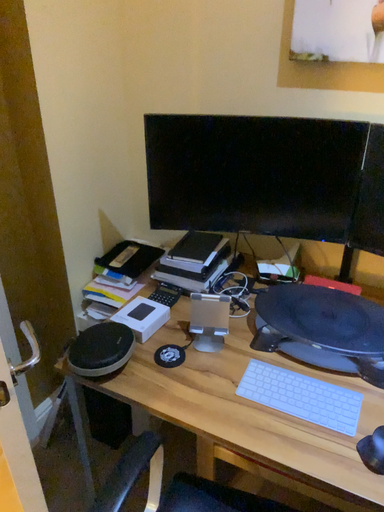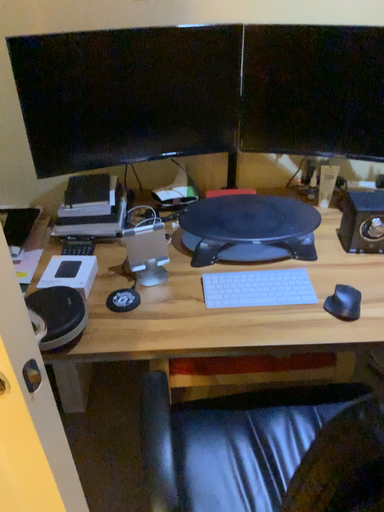
Question: How did the camera likely rotate when shooting the video?

Choices:
 (A) rotated right
 (B) rotated left

Answer: (A)